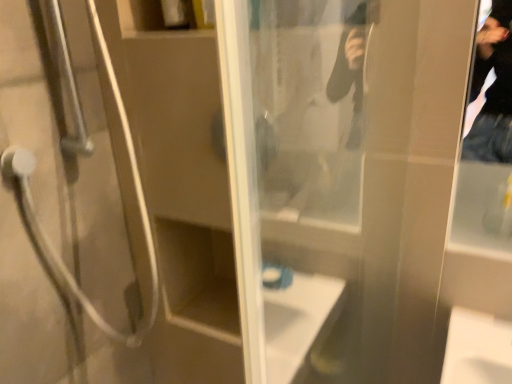
Question: Is point (327, 34) closer or farther from the camera than point (19, 246)?

Choices:
 (A) closer
 (B) farther

Answer: (A)

Question: In terms of size, does transparent glass screen door at center appear bigger or smaller than metallic silver shower door at left?

Choices:
 (A) small
 (B) big

Answer: (A)

Question: In the image, is transparent glass screen door at center on the left side or the right side of metallic silver shower door at left?

Choices:
 (A) right
 (B) left

Answer: (A)

Question: In terms of width, does metallic silver shower door at left look wider or thinner when compared to transparent glass screen door at center?

Choices:
 (A) thin
 (B) wide

Answer: (B)

Question: Is metallic silver shower door at left bigger or smaller than transparent glass screen door at center?

Choices:
 (A) big
 (B) small

Answer: (A)

Question: From their relative heights in the image, would you say metallic silver shower door at left is taller or shorter than transparent glass screen door at center?

Choices:
 (A) tall
 (B) short

Answer: (B)

Question: From the image's perspective, is metallic silver shower door at left above or below transparent glass screen door at center?

Choices:
 (A) above
 (B) below

Answer: (A)